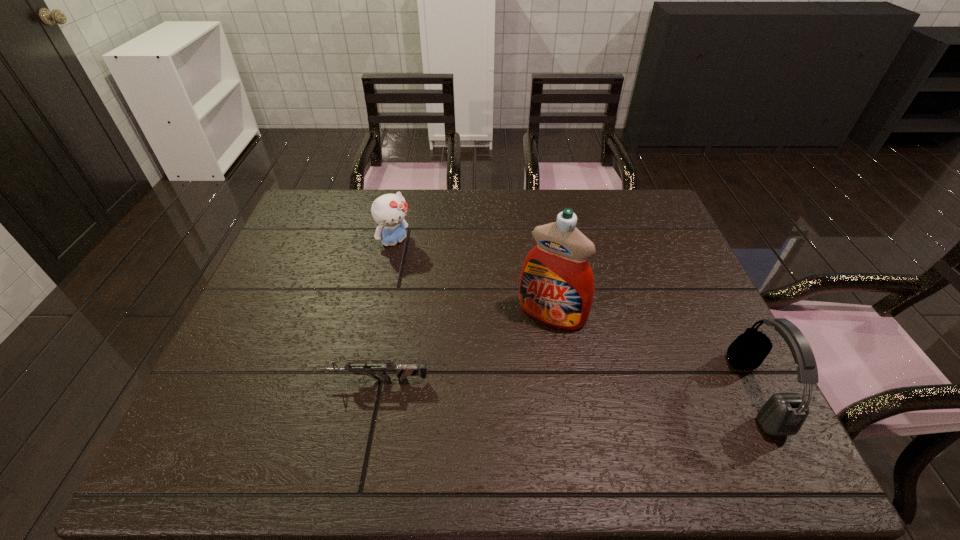
Find the location of `free point that satisfies the following two spatial constraints: 1. on the front side of the second shortest object; 2. on the headband of the second tallest object`. free point that satisfies the following two spatial constraints: 1. on the front side of the second shortest object; 2. on the headband of the second tallest object is located at coordinates (364, 393).